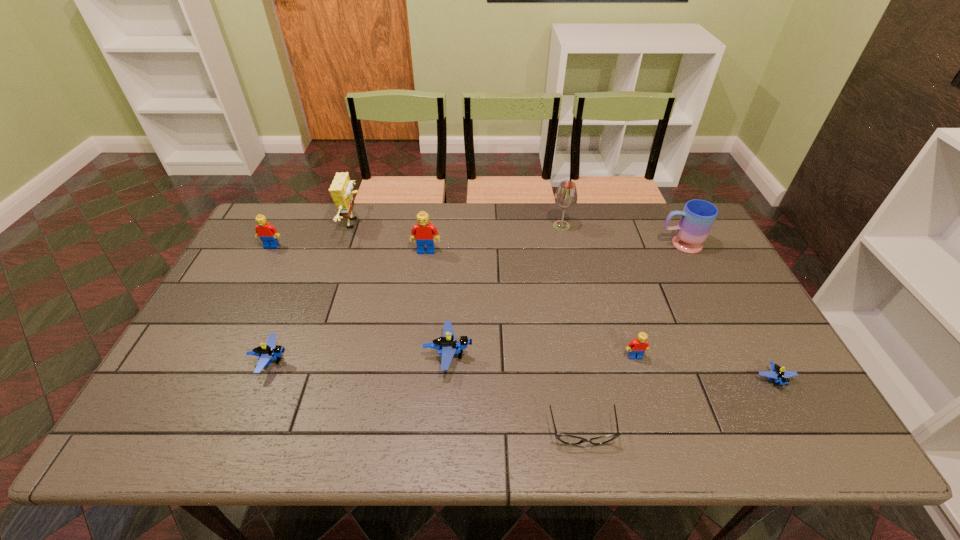
Where is `yellow sponge`? Image resolution: width=960 pixels, height=540 pixels. yellow sponge is located at coordinates click(341, 192).

Identify the location of the eighth object from right to left. This screenshot has width=960, height=540. tap(341, 192).

Locate an element on the screen. This screenshot has height=540, width=960. wineglass is located at coordinates (566, 196).

This screenshot has width=960, height=540. I want to click on the tallest Lego, so click(x=424, y=233).

Locate an element on the screen. The width and height of the screenshot is (960, 540). the second red Lego from left to right is located at coordinates (424, 233).

In order to click on mug in this screenshot , I will do `click(697, 218)`.

Locate an element on the screen. the second smallest red Lego is located at coordinates (267, 233).

What are the coordinates of `the leftmost red Lego` in the screenshot? It's located at (267, 233).

At what (x,y) coordinates should I click in order to perform the action: click on the biggest blue Lego. Please return your answer as a coordinate pair (x, y). Looking at the image, I should click on (447, 345).

The height and width of the screenshot is (540, 960). I want to click on the rightmost red Lego, so [x=637, y=347].